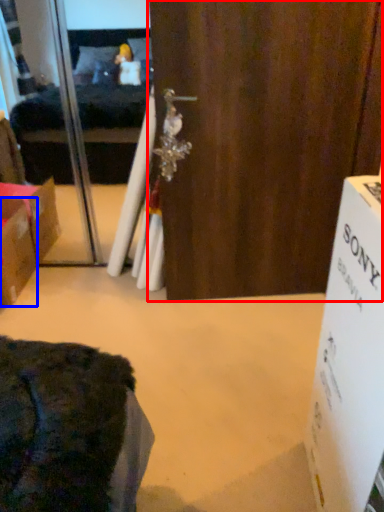
Question: Which object is further to the camera taking this photo, door (highlighted by a red box) or box (highlighted by a blue box)?

Choices:
 (A) door
 (B) box

Answer: (B)